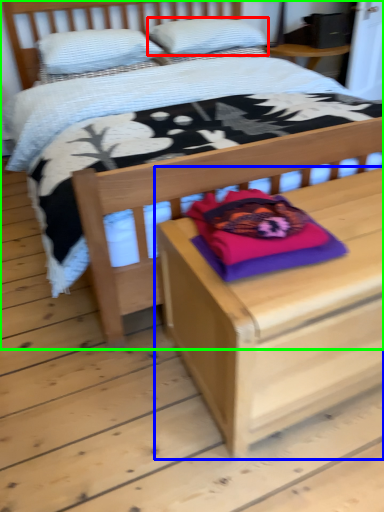
Question: Which object is positioned farthest from pillow (highlighted by a red box)? Select from nightstand (highlighted by a blue box) and bed (highlighted by a green box).

Choices:
 (A) nightstand
 (B) bed

Answer: (A)